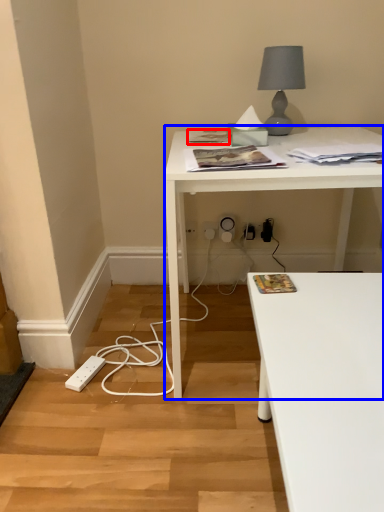
Question: Which of the following is the farthest to the observer, magazine (highlighted by a red box) or desk (highlighted by a blue box)?

Choices:
 (A) magazine
 (B) desk

Answer: (A)